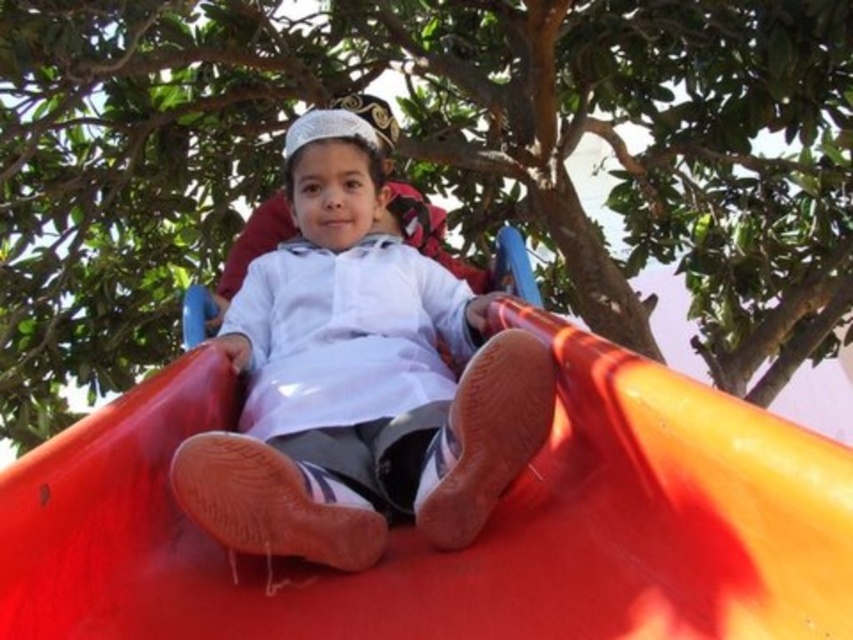
You are a maintenance worker checking the playground equipment. You need to ensure there is enough space between the rubberized red slide at center and the white matte shirt at center for a child to move safely. According to safety guidelines, the minimum required distance is 20 inches. Is the current distance sufficient?

The rubberized red slide at center and the white matte shirt at center are 21.50 inches apart, which exceeds the minimum required distance of 20 inches. Therefore, the current distance is sufficient for safe movement.

You are standing at the playground and want to reach the point marked as point (466,33). If your walking speed is 1.2 meters per second, how many seconds will it take you to reach that point?

The point (466,33) is 11.24 meters away from the viewer. At a walking speed of 1.2 meters per second, it would take approximately 9.37 seconds to reach the point.